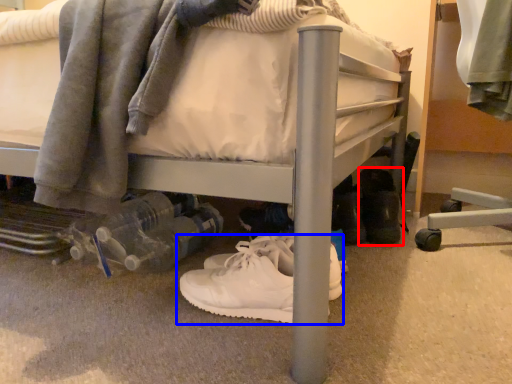
Question: Which object appears closest to the camera in this image, footwear (highlighted by a red box) or footwear (highlighted by a blue box)?

Choices:
 (A) footwear
 (B) footwear

Answer: (B)